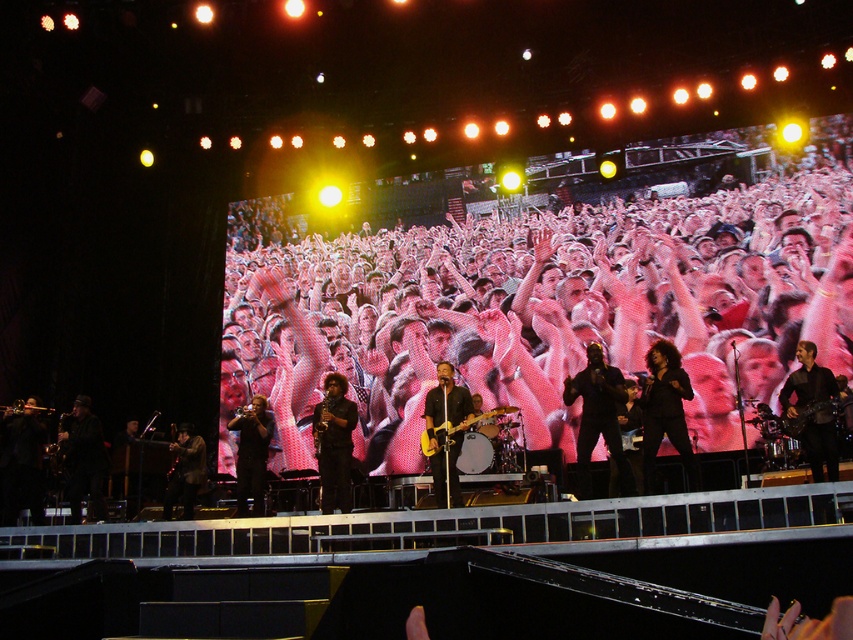
Which of these two, black leather jacket at center or brushed metal saxophone at center, stands taller?

With more height is black leather jacket at center.

Which is in front, point (252, 400) or point (321, 448)?

Point (321, 448)

Locate an element on the screen. Image resolution: width=853 pixels, height=640 pixels. black leather jacket at center is located at coordinates (251, 452).

How far apart are shiny black guitar at center and shiny black guitar at lower left?

shiny black guitar at center and shiny black guitar at lower left are 3.19 meters apart from each other.

The height and width of the screenshot is (640, 853). I want to click on shiny black guitar at center, so click(x=334, y=442).

Does shiny black guitar at center have a greater height compared to black leather guitar at center?

Correct, shiny black guitar at center is much taller as black leather guitar at center.

Is point (320, 451) less distant than point (430, 404)?

No.

Locate an element on the screen. shiny black guitar at center is located at coordinates (334, 442).